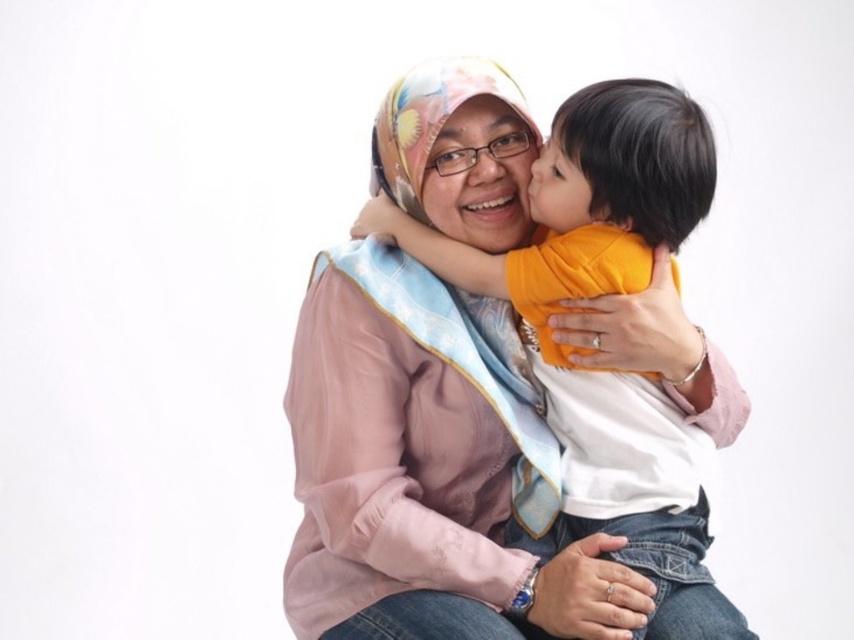
You are an interior designer planning to place a new lamp in the living room. The lamp has a base that requires a 15 cm diameter space. Is the area at point (480,176) suitable for placing the lamp?

The area at point (480,176) has a matte pink scarf at center, which occupies the space. Therefore, placing the lamp there may not be suitable as it would interfere with the existing object.